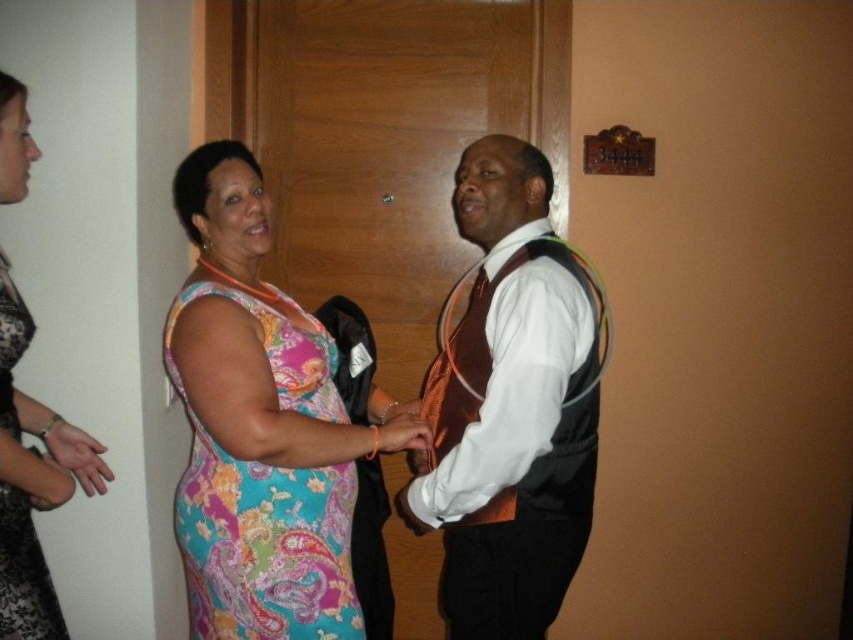
Is the position of floral-patterned fabric dress at center less distant than that of floral fabric dress at center?

No, floral-patterned fabric dress at center is further to the viewer.

Who is more forward, (x=239, y=497) or (x=76, y=472)?

Positioned in front is point (x=239, y=497).

Where is `floral-patterned fabric dress at center`? floral-patterned fabric dress at center is located at coordinates (267, 499).

Measure the distance between orange satin vest at center and camera.

A distance of 1.43 meters exists between orange satin vest at center and camera.

Is orange satin vest at center bigger than matte black hand at lower left?

Yes, orange satin vest at center is bigger than matte black hand at lower left.

Locate an element on the screen. This screenshot has height=640, width=853. orange satin vest at center is located at coordinates (509, 406).

Who is more forward, (27, 618) or (62, 445)?

Point (27, 618) is in front.

The image size is (853, 640). What are the coordinates of `floral fabric dress at center` in the screenshot? It's located at (32, 481).

Identify the location of floral fabric dress at center. The width and height of the screenshot is (853, 640). (32, 481).